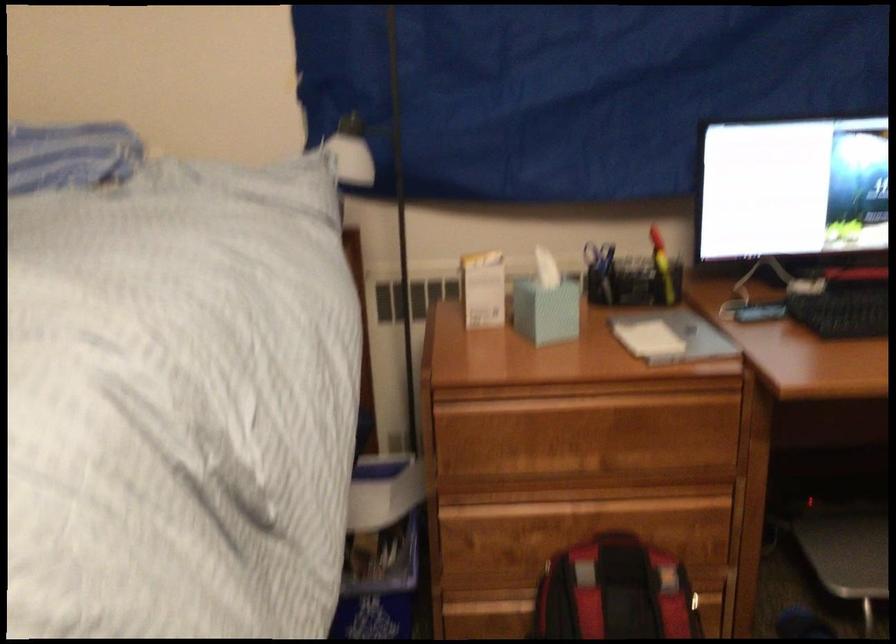
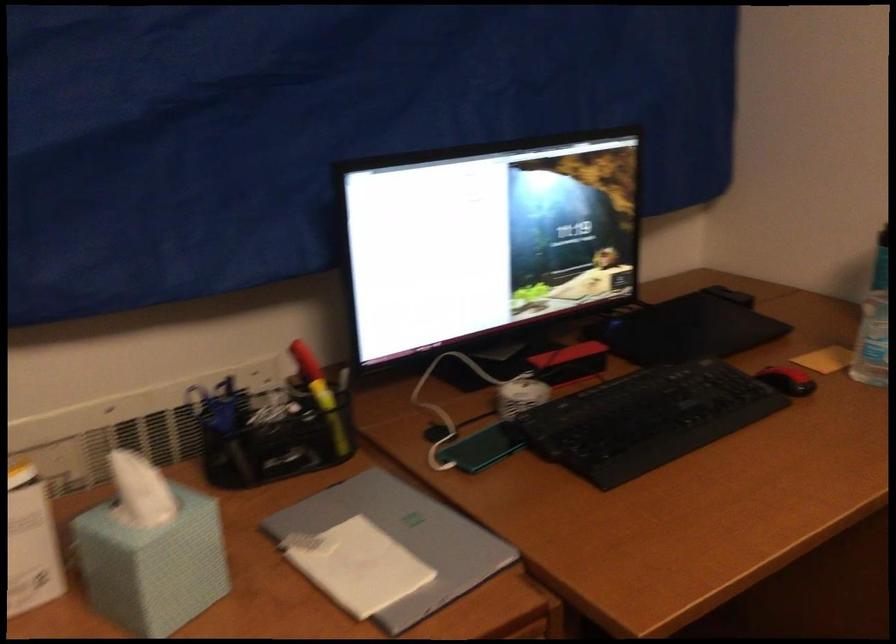
In the second image, find the point that corresponds to (642,337) in the first image.

(357, 565)